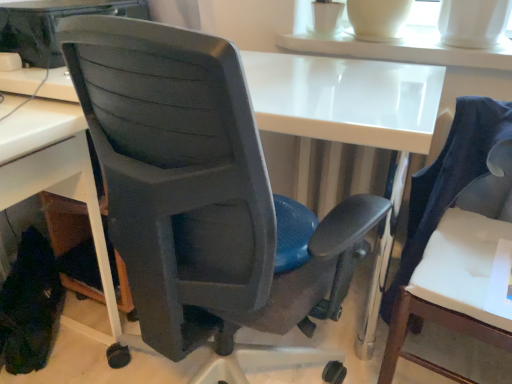
Question: Is white fabric chair at right, the 1th chair viewed from the right, closer to the viewer compared to white plastic desk at lower left?

Choices:
 (A) yes
 (B) no

Answer: (A)

Question: From the image's perspective, is white fabric chair at right, arranged as the 2th chair when viewed from the left, on white plastic desk at lower left?

Choices:
 (A) no
 (B) yes

Answer: (A)

Question: Is white fabric chair at right, arranged as the 2th chair when viewed from the left, not close to white plastic desk at lower left?

Choices:
 (A) no
 (B) yes

Answer: (A)

Question: Is white plastic desk at lower left completely or partially inside white fabric chair at right, the 1th chair viewed from the right?

Choices:
 (A) yes
 (B) no

Answer: (B)

Question: Considering the relative positions of white fabric chair at right, the 1th chair viewed from the right, and white plastic desk at lower left in the image provided, is white fabric chair at right, the 1th chair viewed from the right, to the left of white plastic desk at lower left from the viewer's perspective?

Choices:
 (A) yes
 (B) no

Answer: (B)

Question: Could you tell me if white fabric chair at right, arranged as the 2th chair when viewed from the left, is facing white plastic desk at lower left?

Choices:
 (A) no
 (B) yes

Answer: (A)

Question: Can you confirm if white plastic desk at lower left is smaller than white glossy table at upper center?

Choices:
 (A) yes
 (B) no

Answer: (B)

Question: Does white plastic desk at lower left appear on the right side of white glossy table at upper center?

Choices:
 (A) yes
 (B) no

Answer: (B)

Question: From the image's perspective, would you say white plastic desk at lower left is positioned over white glossy table at upper center?

Choices:
 (A) yes
 (B) no

Answer: (B)

Question: From a real-world perspective, is white plastic desk at lower left on top of white glossy table at upper center?

Choices:
 (A) yes
 (B) no

Answer: (B)

Question: Does white plastic desk at lower left lie behind white glossy table at upper center?

Choices:
 (A) no
 (B) yes

Answer: (A)

Question: Is white plastic desk at lower left outside of white glossy table at upper center?

Choices:
 (A) yes
 (B) no

Answer: (A)

Question: Is matte plastic chair at center, the first chair from the left, to the right of white plastic desk at lower left from the viewer's perspective?

Choices:
 (A) yes
 (B) no

Answer: (A)